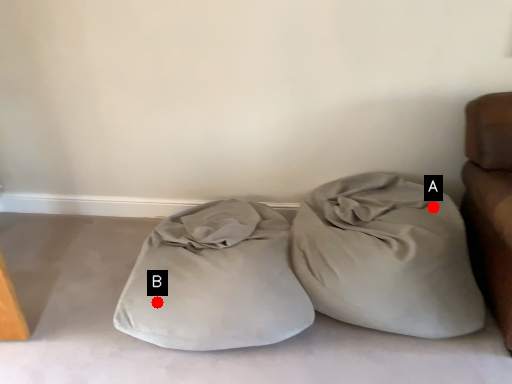
Question: Two points are circled on the image, labeled by A and B beside each circle. Which point is closer to the camera?

Choices:
 (A) A is closer
 (B) B is closer

Answer: (B)